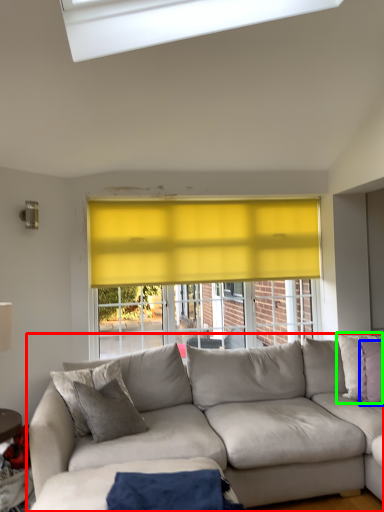
Question: Which is farther away from studio couch (highlighted by a red box)? pillow (highlighted by a blue box) or pillow (highlighted by a green box)?

Choices:
 (A) pillow
 (B) pillow

Answer: (A)